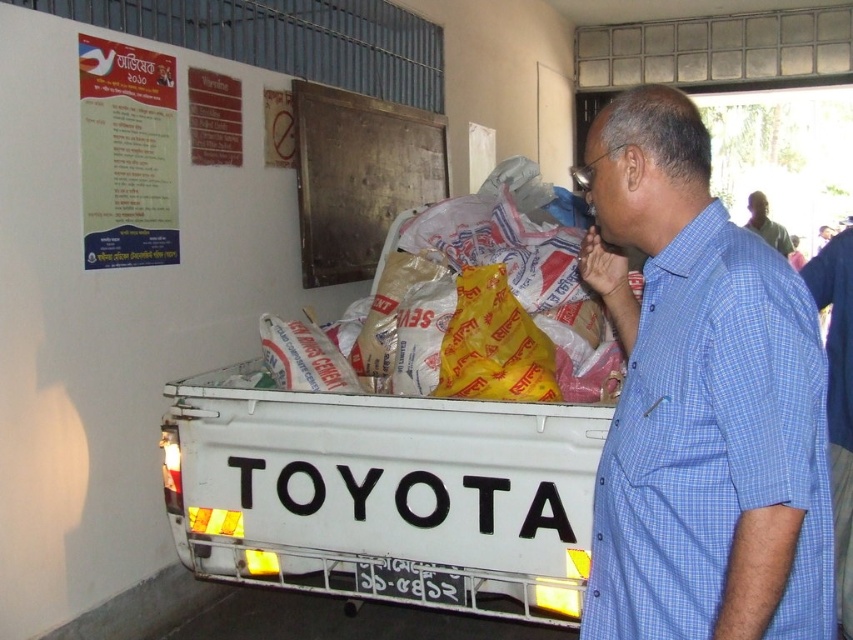
Question: Estimate the real-world distances between objects in this image. Which object is farther from the wooden board at upper center?

Choices:
 (A) blue checkered shirt at right
 (B) dark blue shirt at right

Answer: (B)

Question: Which object is the closest to the wooden board at upper center?

Choices:
 (A) dark blue shirt at right
 (B) blue checkered shirt at right

Answer: (B)

Question: From the image, what is the correct spatial relationship of blue checkered shirt at right in relation to wooden board at upper center?

Choices:
 (A) right
 (B) left

Answer: (A)

Question: Considering the real-world distances, which object is closest to the dark blue shirt at right?

Choices:
 (A) blue checkered shirt at right
 (B) wooden board at upper center

Answer: (B)

Question: Does wooden board at upper center come in front of dark blue shirt at right?

Choices:
 (A) yes
 (B) no

Answer: (A)

Question: Does blue checkered shirt at right appear on the right side of dark blue shirt at right?

Choices:
 (A) no
 (B) yes

Answer: (A)